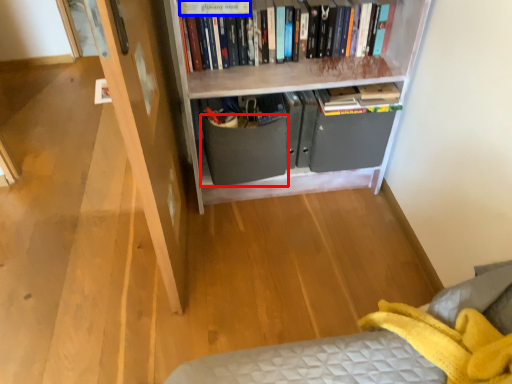
Question: Which object appears farthest to the camera in this image, drawer (highlighted by a red box) or paperback book (highlighted by a blue box)?

Choices:
 (A) drawer
 (B) paperback book

Answer: (A)